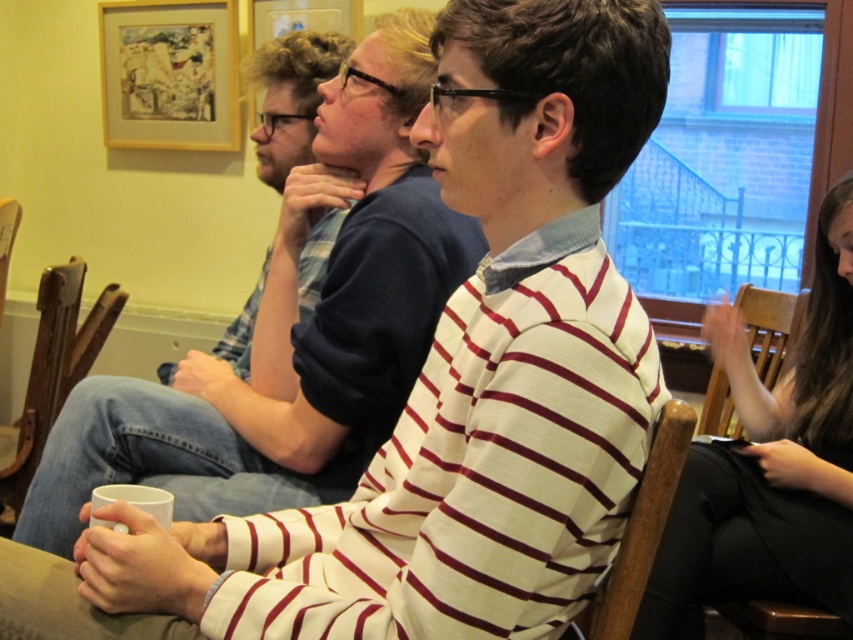
Question: Does smooth black hair at right appear under wooden chair at center?

Choices:
 (A) no
 (B) yes

Answer: (A)

Question: From the image, what is the correct spatial relationship of smooth black hair at right in relation to white matte mug at center?

Choices:
 (A) below
 (B) above

Answer: (A)

Question: Does white matte mug at center have a larger size compared to brown wooden chair at lower left?

Choices:
 (A) yes
 (B) no

Answer: (B)

Question: Which point is farther from the camera taking this photo?

Choices:
 (A) (840, 547)
 (B) (622, 538)
 (C) (761, 317)

Answer: (C)

Question: Considering the real-world distances, which object is farthest from the smooth black hair at right?

Choices:
 (A) brown wooden chair at lower left
 (B) wooden chair at center
 (C) white matte mug at center
 (D) wooden chair at right

Answer: (A)

Question: Based on their relative distances, which object is nearer to the wooden chair at right?

Choices:
 (A) brown wooden chair at lower left
 (B) smooth black hair at right
 (C) wooden chair at center
 (D) white matte mug at center

Answer: (B)